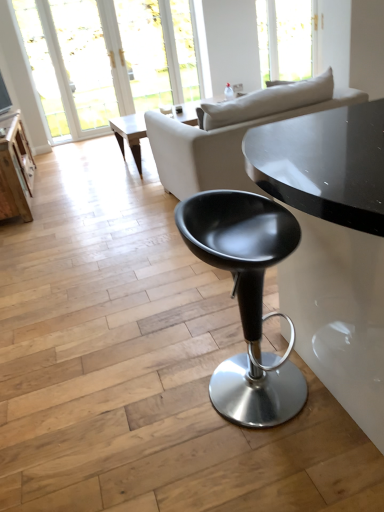
The height and width of the screenshot is (512, 384). What do you see at coordinates (232, 134) in the screenshot? I see `white fabric couch at upper center` at bounding box center [232, 134].

The height and width of the screenshot is (512, 384). Identify the location of white fabric couch at upper center. (232, 134).

Describe the element at coordinates (130, 134) in the screenshot. I see `light wood coffee table at center` at that location.

The width and height of the screenshot is (384, 512). Describe the element at coordinates (247, 298) in the screenshot. I see `matte black stool at center` at that location.

What is the approximate width of wooden table at left?

17.03 inches.

Locate an element on the screen. The image size is (384, 512). white fabric couch at upper center is located at coordinates (232, 134).

Is transparent glass door at upper left with light wood coffee table at center?

No, transparent glass door at upper left is not making contact with light wood coffee table at center.

Is transparent glass door at upper left taller or shorter than light wood coffee table at center?

Clearly, transparent glass door at upper left is taller compared to light wood coffee table at center.

Is transparent glass door at upper left positioned beyond the bounds of light wood coffee table at center?

Yes, transparent glass door at upper left is not within light wood coffee table at center.

Does transparent glass door at upper left have a greater width compared to light wood coffee table at center?

Incorrect, the width of transparent glass door at upper left does not surpass that of light wood coffee table at center.

Is matte black stool at center next to transparent glass door at upper left?

They are not placed beside each other.

Find the location of a particular element. window above the matte black stool at center (from the image's perspective) is located at coordinates (41, 67).

How many degrees apart are the facing directions of matte black stool at center and transparent glass door at upper left?

They differ by 51.8 degrees in their facing directions.

Does matte black stool at center have a smaller size compared to transparent glass door at upper left?

Actually, matte black stool at center might be larger than transparent glass door at upper left.

Which is behind, point (127, 140) or point (279, 40)?

Point (279, 40)

From a real-world perspective, does light wood coffee table at center sit lower than transparent glass window at upper center?

Yes.

Is light wood coffee table at center thinner than transparent glass window at upper center?

In fact, light wood coffee table at center might be wider than transparent glass window at upper center.

Considering the relative positions of light wood coffee table at center and transparent glass window at upper center in the image provided, is light wood coffee table at center to the left of transparent glass window at upper center from the viewer's perspective?

Correct, you'll find light wood coffee table at center to the left of transparent glass window at upper center.

Is the position of light wood coffee table at center more distant than that of wooden table at left?

Yes, light wood coffee table at center is further from the camera.

Is light wood coffee table at center facing away from wooden table at left?

No, light wood coffee table at center is not facing the opposite direction of wooden table at left.

Which of these two, light wood coffee table at center or wooden table at left, is bigger?

Bigger between the two is light wood coffee table at center.

Based on the photo, between light wood coffee table at center and transparent glass door at upper left, which one has more height?

transparent glass door at upper left is taller.

Is light wood coffee table at center closer to camera compared to transparent glass door at upper left?

Yes, it is in front of transparent glass door at upper left.

Is light wood coffee table at center turned away from transparent glass door at upper left?

light wood coffee table at center is not turned away from transparent glass door at upper left.

Does point (139, 164) appear closer or farther from the camera than point (52, 77)?

Point (139, 164) is positioned closer to the camera compared to point (52, 77).

From a real-world perspective, which object stands above the other?

white fabric couch at upper center, from a real-world perspective.

Is white fabric couch at upper center far away from matte black stool at center?

Yes.

Is white fabric couch at upper center not inside matte black stool at center?

Yes, white fabric couch at upper center is not within matte black stool at center.

Consider the image. Is white fabric couch at upper center oriented towards matte black stool at center?

No, white fabric couch at upper center is not turned towards matte black stool at center.

From a real-world perspective, who is located lower, transparent glass door at upper left or transparent glass window at upper center?

transparent glass window at upper center.

Is transparent glass door at upper left oriented towards transparent glass window at upper center?

No, transparent glass door at upper left is not turned towards transparent glass window at upper center.

From the picture: Between transparent glass door at upper left and transparent glass window at upper center, which one appears on the right side from the viewer's perspective?

From the viewer's perspective, transparent glass window at upper center appears more on the right side.

Would you say transparent glass window at upper center is part of transparent glass door at upper left's contents?

Definitely not — transparent glass window at upper center is not inside transparent glass door at upper left.

Where is `window above the light wood coffee table at center (from a real-world perspective)`? The width and height of the screenshot is (384, 512). window above the light wood coffee table at center (from a real-world perspective) is located at coordinates (41, 67).

Where is `chair below the transparent glass door at upper left (from a real-world perspective)`? chair below the transparent glass door at upper left (from a real-world perspective) is located at coordinates (247, 298).

Estimate the real-world distances between objects in this image. Which object is further from transparent glass door at upper left, matte black stool at center or light wood coffee table at center?

matte black stool at center.

When comparing their distances from transparent glass window at upper center, does wooden table at left or matte black stool at center seem closer?

Among the two, wooden table at left is located nearer to transparent glass window at upper center.

Looking at the image, which one is located further to white fabric couch at upper center, matte black stool at center or light wood coffee table at center?

The object further to white fabric couch at upper center is light wood coffee table at center.

When comparing their distances from wooden table at left, does matte black stool at center or light wood coffee table at center seem further?

Among the two, matte black stool at center is located further to wooden table at left.

In the scene shown: Which object lies nearer to the anchor point light wood coffee table at center, wooden table at left or matte black stool at center?

wooden table at left lies closer to light wood coffee table at center than the other object.

Estimate the real-world distances between objects in this image. Which object is closer to white fabric couch at upper center, matte black stool at center or transparent glass window at upper center?

matte black stool at center lies closer to white fabric couch at upper center than the other object.

Based on their spatial positions, is white fabric couch at upper center or transparent glass door at upper left closer to matte black stool at center?

white fabric couch at upper center is closer to matte black stool at center.

From the image, which object appears to be nearer to transparent glass window at upper center, matte black stool at center or light wood coffee table at center?

light wood coffee table at center is positioned closer to the anchor transparent glass window at upper center.

Identify the location of coffee table between white fabric couch at upper center and transparent glass door at upper left along the z-axis. Image resolution: width=384 pixels, height=512 pixels. (130, 134).

At what (x,y) coordinates should I click in order to perform the action: click on coffee table between transparent glass door at upper left and transparent glass window at upper center. Please return your answer as a coordinate pair (x, y). Looking at the image, I should click on (130, 134).

This screenshot has width=384, height=512. I want to click on coffee table between wooden table at left and transparent glass window at upper center from left to right, so click(130, 134).

This screenshot has height=512, width=384. I want to click on chair situated between wooden table at left and white fabric couch at upper center from left to right, so click(x=247, y=298).